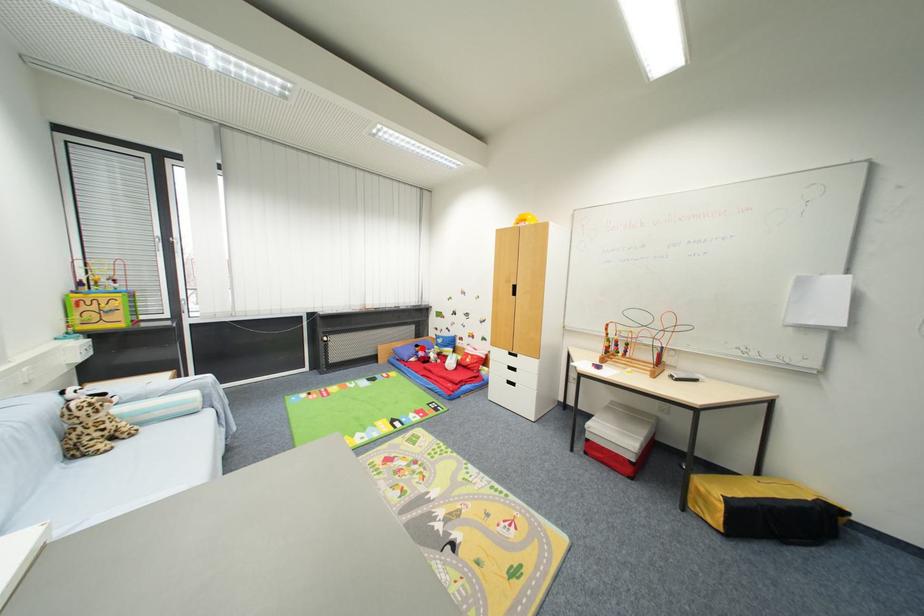
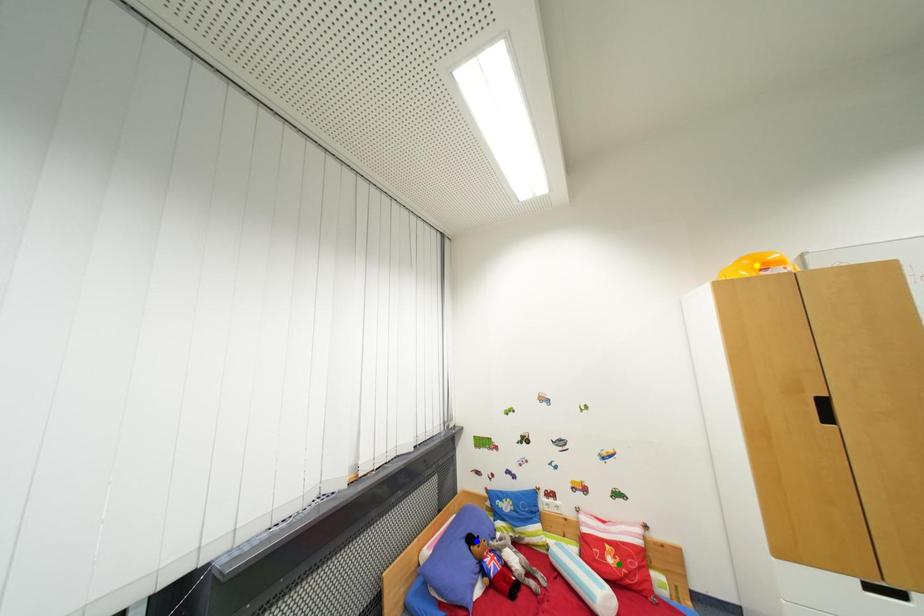
Question: I am providing you with two images of the same scene from different viewpoints. A red point is marked on the first image. You are given multiple points on the second image. Which mark in image 2 goes with the point in image 1?

Choices:
 (A) green point
 (B) blue point
 (C) yellow point

Answer: (B)